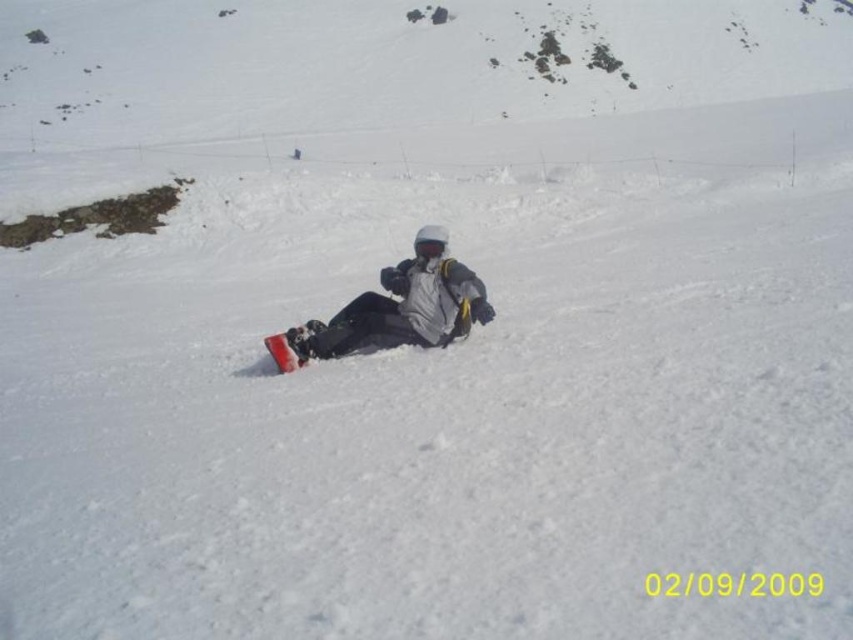
Describe the element at coordinates (403, 305) in the screenshot. I see `matte gray snowboard at center` at that location.

Does matte gray snowboard at center have a greater height compared to matte red snowboard at center?

Yes.

This screenshot has height=640, width=853. Identify the location of matte gray snowboard at center. (403, 305).